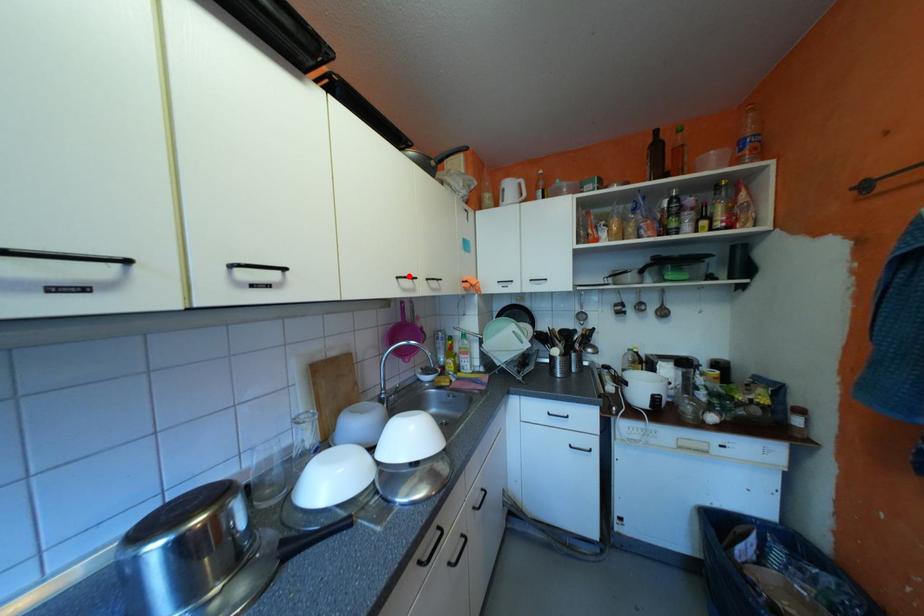
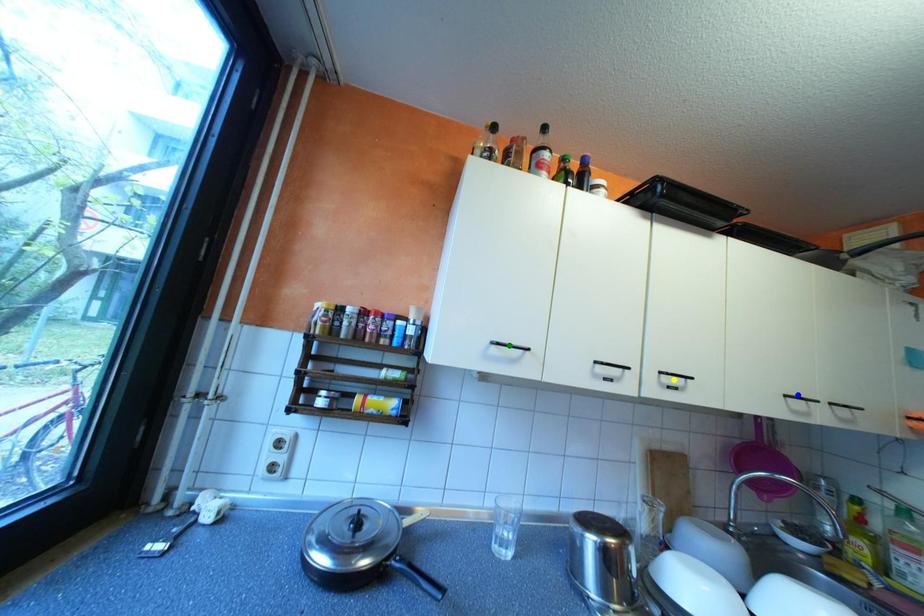
Question: I am providing you with two images of the same scene from different viewpoints. A red point is marked on the first image. You are given multiple points on the second image. Which mark in image 2 goes with the point in image 1?

Choices:
 (A) yellow point
 (B) blue point
 (C) green point

Answer: (B)